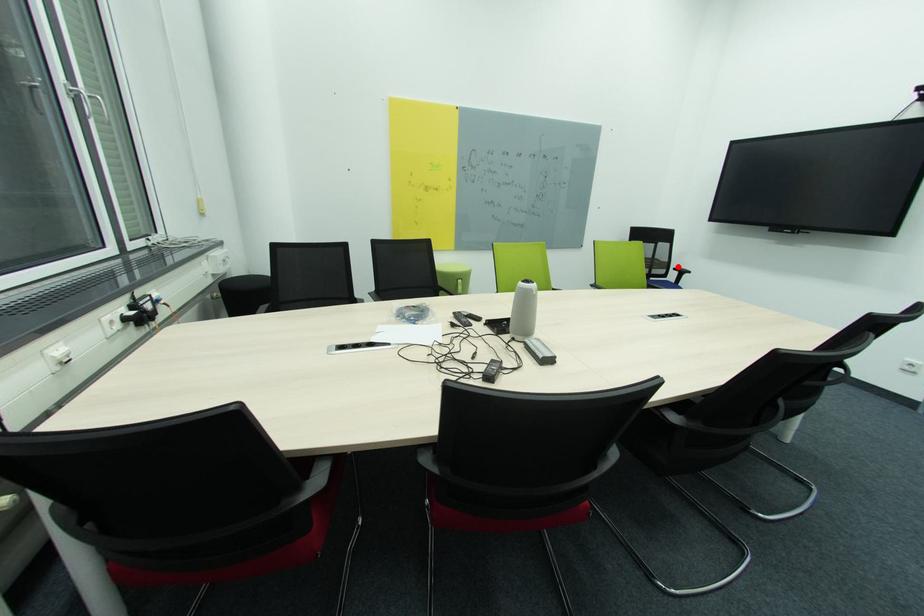
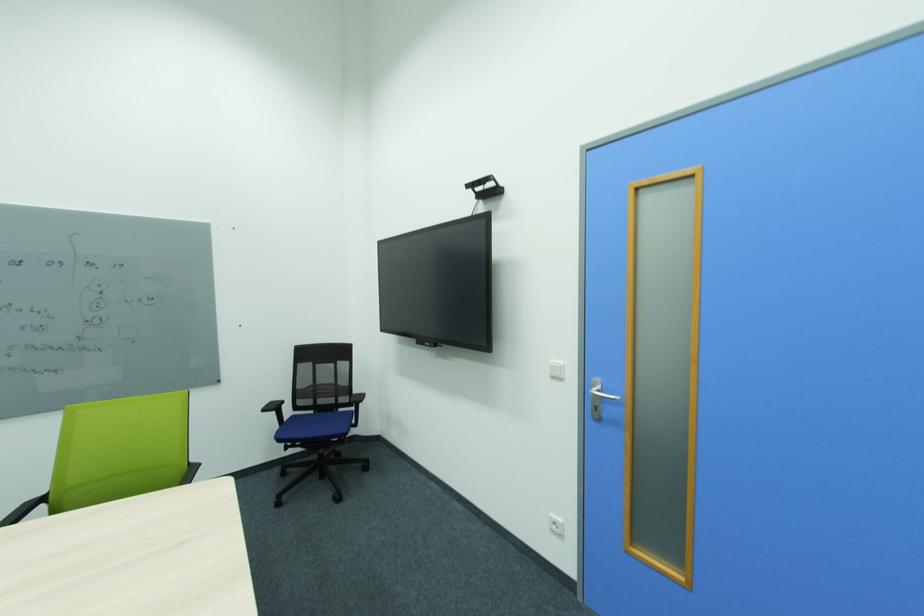
The point at the highlighted location is marked in the first image. Where is the corresponding point in the second image?

(360, 392)